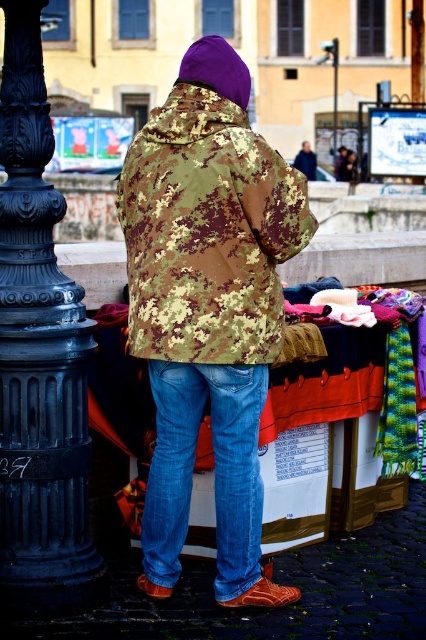
Which is above, camouflage fabric jacket at center or metallic pole at upper center?

metallic pole at upper center

Consider the image. Who is more forward, (183,282) or (333,108)?

Positioned in front is point (183,282).

Is point (187, 131) farther from camera compared to point (334, 60)?

No, (187, 131) is closer to viewer.

Image resolution: width=426 pixels, height=640 pixels. In order to click on camouflage fabric jacket at center in this screenshot , I will do `click(207, 232)`.

Who is more forward, (0,310) or (305,150)?

Positioned in front is point (0,310).

Is point (68, 428) positioned behind point (302, 160)?

No, (68, 428) is in front of (302, 160).

Which is behind, point (17, 81) or point (304, 141)?

The point (304, 141) is more distant.

At what (x,y) coordinates should I click in order to perform the action: click on black cast iron post at left. Please return your answer as a coordinate pair (x, y). Image resolution: width=426 pixels, height=640 pixels. Looking at the image, I should click on (39, 353).

What do you see at coordinates (207, 232) in the screenshot? Image resolution: width=426 pixels, height=640 pixels. I see `camouflage fabric jacket at center` at bounding box center [207, 232].

This screenshot has width=426, height=640. Find the location of `camouflage fabric jacket at center`. camouflage fabric jacket at center is located at coordinates (207, 232).

Identify the location of camouflage fabric jacket at center. Image resolution: width=426 pixels, height=640 pixels. (207, 232).